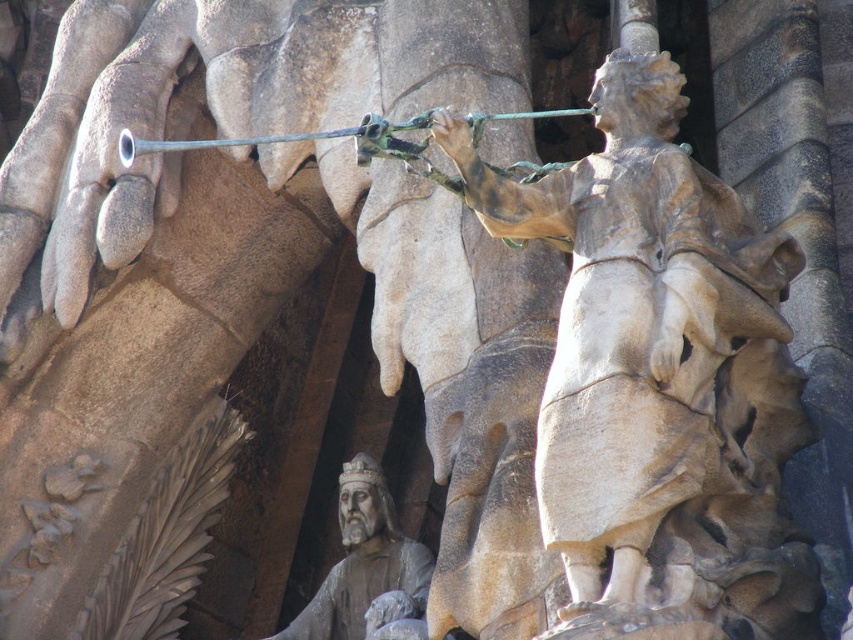
You are an art student analyzing the spatial arrangement of the sculptures. Which statue is closer to you, the stone statue at center or the smooth stone statue at lower center?

The stone statue at center is closer to you because it is positioned in front of the smooth stone statue at lower center.

You are standing in front of the stone sculpture and want to touch the two points labeled point (x=679, y=81) and point (x=387, y=516). Which point will require you to reach further forward?

Point (x=387, y=516) will require you to reach further forward because it is farther from the camera compared to point (x=679, y=81).

You are an art student analyzing the stone sculptures in the image. You see the stone statue at center and the smooth stone statue at lower center. Based on their positions, which one is located to the right of the other?

The stone statue at center is to the right of the smooth stone statue at lower center.